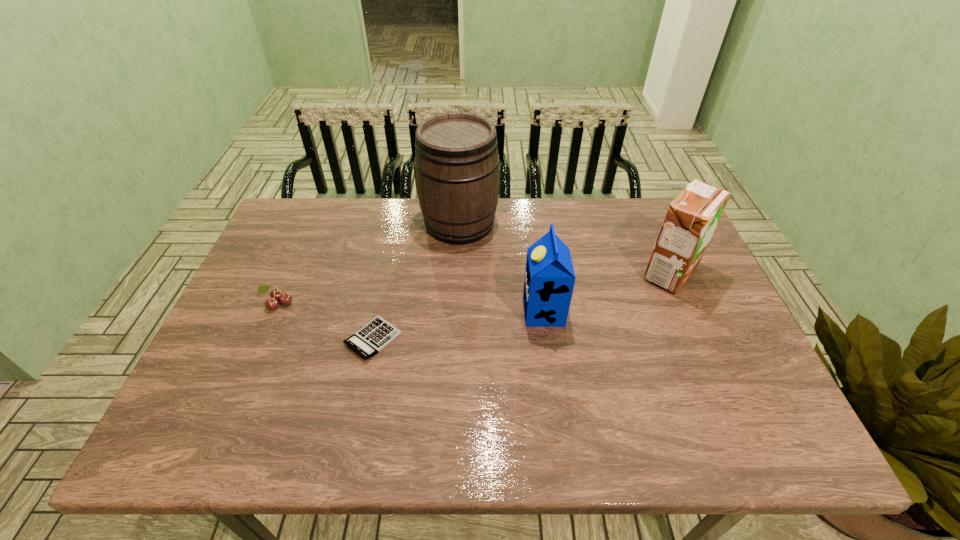
This screenshot has width=960, height=540. What are the coordinates of `vacant space situated 0.250m on the front of the wine bucket` in the screenshot? It's located at (455, 312).

The image size is (960, 540). Find the location of `free location located 0.180m on the straw side of the right carton`. free location located 0.180m on the straw side of the right carton is located at coordinates 576,273.

You are a GUI agent. You are given a task and a screenshot of the screen. Output one action in this format:
    pyautogui.click(x=<x>, y=<y>)
    Task: Click on the vacant area located on the straw side of the right carton
    The height and width of the screenshot is (540, 960).
    Given the screenshot: What is the action you would take?
    pyautogui.click(x=541, y=273)

What are the coordinates of `free space located 0.130m on the straw side of the right carton` in the screenshot? It's located at (594, 273).

Where is `vacant space located with the cap open on the left carton`? The height and width of the screenshot is (540, 960). vacant space located with the cap open on the left carton is located at coordinates (463, 312).

This screenshot has height=540, width=960. What are the coordinates of `vacant area situated 0.270m with the cap open on the left carton` in the screenshot? It's located at (420, 312).

You are a GUI agent. You are given a task and a screenshot of the screen. Output one action in this format:
    pyautogui.click(x=<x>, y=<y>)
    Task: Click on the free space located 0.280m with the cap open on the left carton
    
    Given the screenshot: What is the action you would take?
    pyautogui.click(x=417, y=312)

Where is `vacant area situated 0.260m on the leaves of the leftmost object`? vacant area situated 0.260m on the leaves of the leftmost object is located at coordinates (235, 403).

Where is `vacant space located on the back of the second object from left to right`? This screenshot has width=960, height=540. vacant space located on the back of the second object from left to right is located at coordinates (396, 233).

Where is `object at the far edge`? The height and width of the screenshot is (540, 960). object at the far edge is located at coordinates (456, 153).